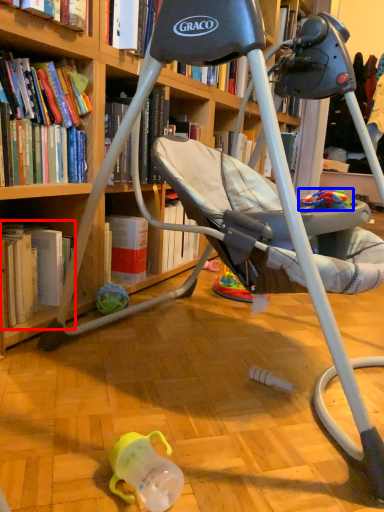
Question: Which object is closer to the camera taking this photo, book (highlighted by a red box) or toy (highlighted by a blue box)?

Choices:
 (A) book
 (B) toy

Answer: (B)